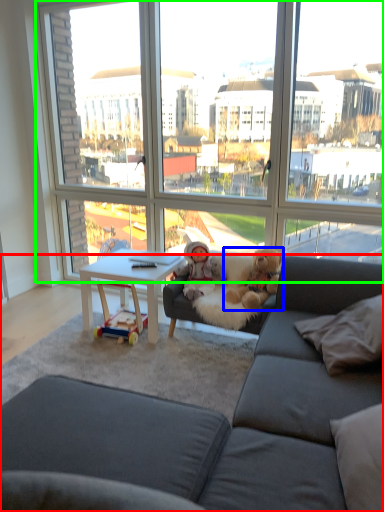
Question: Based on their relative distances, which object is nearer to studio couch (highlighted by a red box)? Choose from teddy bear (highlighted by a blue box) and window (highlighted by a green box).

Choices:
 (A) teddy bear
 (B) window

Answer: (A)